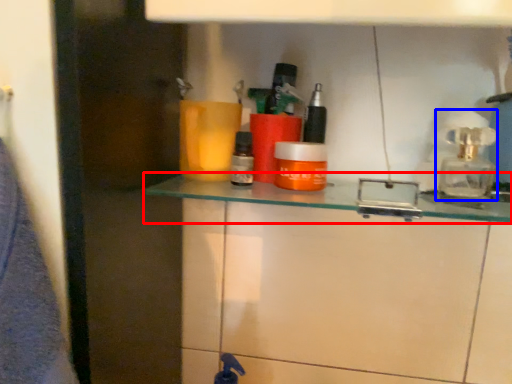
Question: Which point is closer to the camera, shelf (highlighted by a red box) or soap dispenser (highlighted by a blue box)?

Choices:
 (A) shelf
 (B) soap dispenser

Answer: (A)